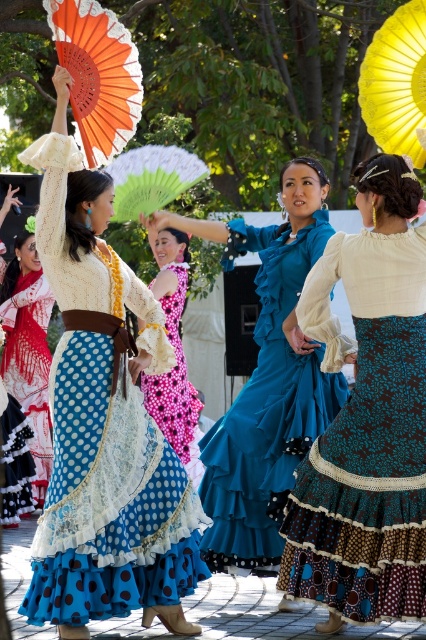
You are a photographer trying to capture the two dancers in the center of the scene. You notice the matte white lace dress at center and the matte blue dress at center. Which one is positioned to the left of the other?

The matte white lace dress at center is positioned on the left side of the matte blue dress at center.

You are a photographer trying to capture the vibrant outdoor scene with the flamenco dancers. You want to focus on the two points in the image labeled as point (327,561) and point (163,157). Which of these points is positioned closer to the camera?

Point (327,561) is closer to the camera than point (163,157).

You are a photographer at the event and want to capture a closeup shot of both the teal satin dress at center and the green fabric fan at center. Since you can only focus on one object at a time, which one should you choose to ensure the other is still in the frame?

The teal satin dress at center is smaller than the green fabric fan at center, so focusing on the larger green fabric fan at center will ensure the smaller teal satin dress at center remains in the frame.